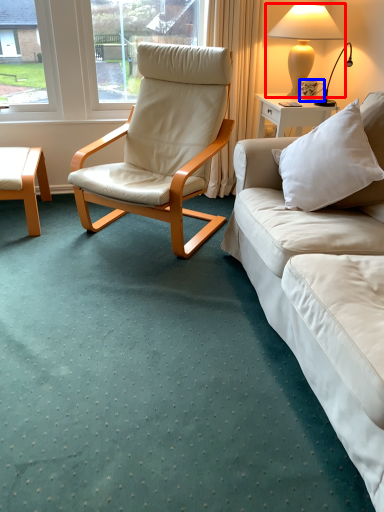
Question: Which object is further to the camera taking this photo, lamp (highlighted by a red box) or coffee cup (highlighted by a blue box)?

Choices:
 (A) lamp
 (B) coffee cup

Answer: (B)